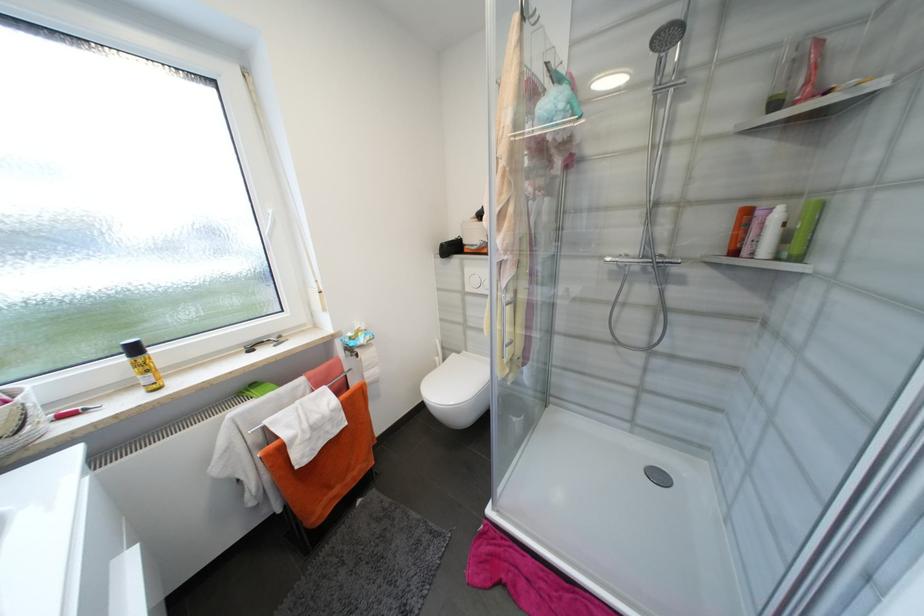
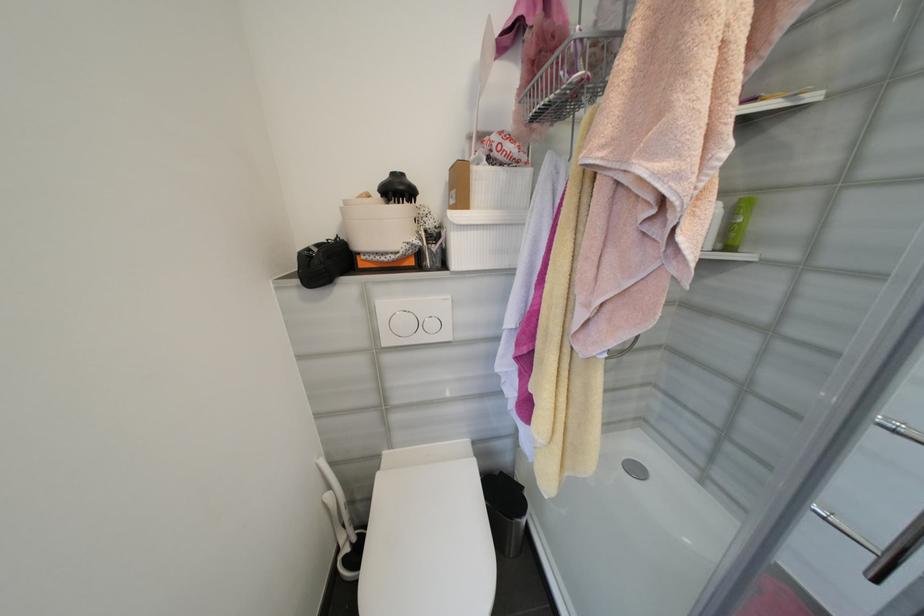
Question: The camera is either moving clockwise (left) or counter-clockwise (right) around the object. The first image is from the beginning of the video and the second image is from the end. Is the camera moving left or right when shooting the video?

Choices:
 (A) Left
 (B) Right

Answer: (A)